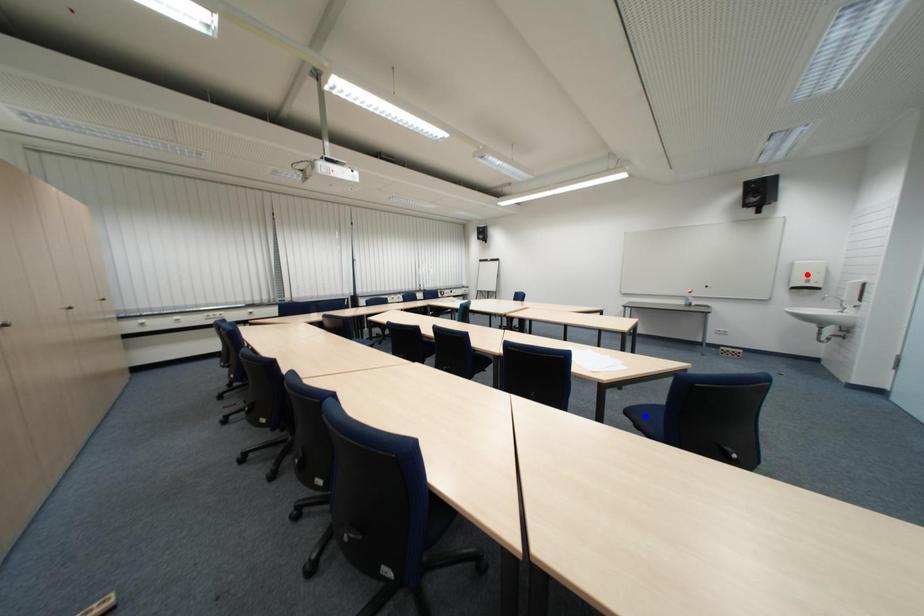
Question: Two points are marked on the image. Which point is closer to the camera?

Choices:
 (A) Blue point is closer.
 (B) Red point is closer.

Answer: (A)